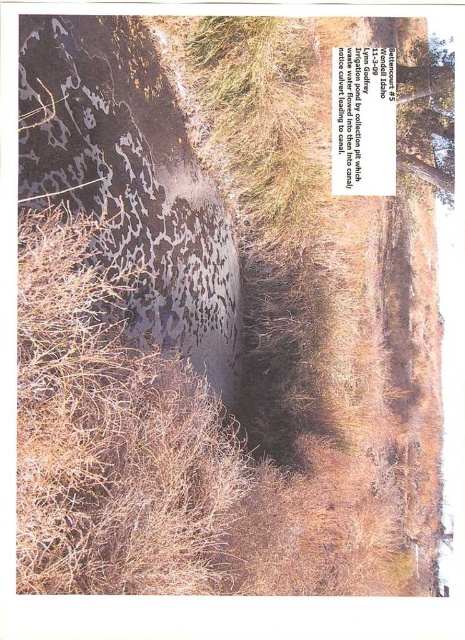
Does dark textured rock at left have a greater height compared to green leafy tree at upper right?

Correct, dark textured rock at left is much taller as green leafy tree at upper right.

Who is more forward, (154, 202) or (424, 104)?

Point (154, 202)

Is point (19, 192) less distant than point (418, 136)?

Yes, point (19, 192) is in front of point (418, 136).

What are the coordinates of `dark textured rock at left` in the screenshot? It's located at (132, 179).